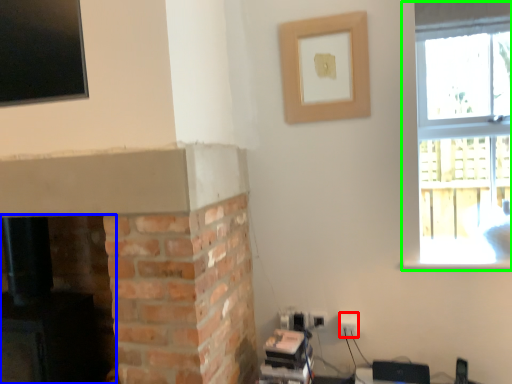
Question: Considering the real-world distances, which object is closest to electric outlet (highlighted by a red box)? fireplace (highlighted by a blue box) or window (highlighted by a green box).

Choices:
 (A) fireplace
 (B) window

Answer: (A)